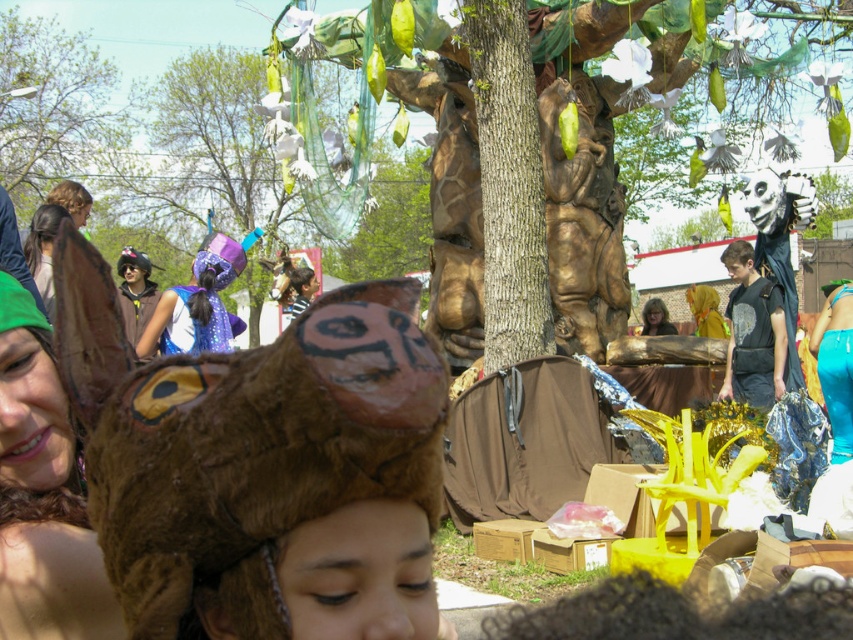
Question: Does shiny purple fabric at center appear on the right side of teal satin dress at lower right?

Choices:
 (A) no
 (B) yes

Answer: (A)

Question: Is green matte tree at upper center to the right of shiny purple fabric at center from the viewer's perspective?

Choices:
 (A) yes
 (B) no

Answer: (B)

Question: Among these points, which one is nearest to the camera?

Choices:
 (A) (45, 467)
 (B) (851, 448)

Answer: (A)

Question: Among these points, which one is farthest from the camera?

Choices:
 (A) (x=20, y=520)
 (B) (x=770, y=308)
 (C) (x=201, y=266)
 (D) (x=666, y=310)

Answer: (D)

Question: Is the position of sparkly purple cape at center less distant than that of matte brown hair at center?

Choices:
 (A) yes
 (B) no

Answer: (A)

Question: Among these points, which one is nearest to the camera?

Choices:
 (A) (650, 321)
 (B) (837, 381)
 (C) (146, 353)
 (D) (187, 134)

Answer: (B)